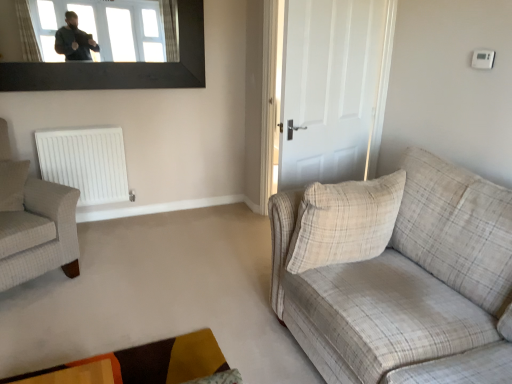
Question: Is white matte door at center surrounding velvet-like brown and orange rug at lower center?

Choices:
 (A) no
 (B) yes

Answer: (A)

Question: Does white matte door at center appear on the right side of velvet-like brown and orange rug at lower center?

Choices:
 (A) no
 (B) yes

Answer: (B)

Question: From a real-world perspective, is white matte door at center under velvet-like brown and orange rug at lower center?

Choices:
 (A) no
 (B) yes

Answer: (A)

Question: Can you confirm if white matte door at center is bigger than velvet-like brown and orange rug at lower center?

Choices:
 (A) no
 (B) yes

Answer: (B)

Question: From a real-world perspective, is white matte door at center positioned over velvet-like brown and orange rug at lower center based on gravity?

Choices:
 (A) yes
 (B) no

Answer: (A)

Question: Is white matte radiator at left to the left or to the right of white matte door at center in the image?

Choices:
 (A) left
 (B) right

Answer: (A)

Question: Is white matte radiator at left spatially inside white matte door at center, or outside of it?

Choices:
 (A) inside
 (B) outside

Answer: (B)

Question: Is white matte radiator at left in front of or behind white matte door at center in the image?

Choices:
 (A) front
 (B) behind

Answer: (B)

Question: Is point (96, 203) positioned closer to the camera than point (337, 99)?

Choices:
 (A) farther
 (B) closer

Answer: (A)

Question: From a real-world perspective, relative to plaid fabric armchair at left, is transparent glass window at upper center vertically above or below?

Choices:
 (A) above
 (B) below

Answer: (A)

Question: Is point (49, 49) closer or farther from the camera than point (57, 215)?

Choices:
 (A) farther
 (B) closer

Answer: (A)

Question: Looking at their shapes, would you say transparent glass window at upper center is wider or thinner than plaid fabric armchair at left?

Choices:
 (A) wide
 (B) thin

Answer: (B)

Question: Do you think transparent glass window at upper center is within plaid fabric armchair at left, or outside of it?

Choices:
 (A) outside
 (B) inside

Answer: (A)

Question: Choose the correct answer: Is transparent glass window at upper center inside beige plaid pillow at left, the 2th pillow from the right, or outside it?

Choices:
 (A) inside
 (B) outside

Answer: (B)

Question: In terms of width, does transparent glass window at upper center look wider or thinner when compared to beige plaid pillow at left, positioned as the second pillow in front-to-back order?

Choices:
 (A) thin
 (B) wide

Answer: (A)